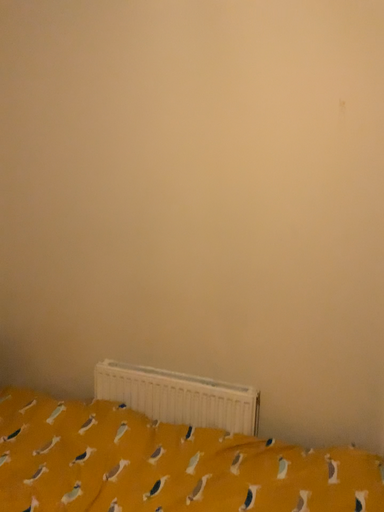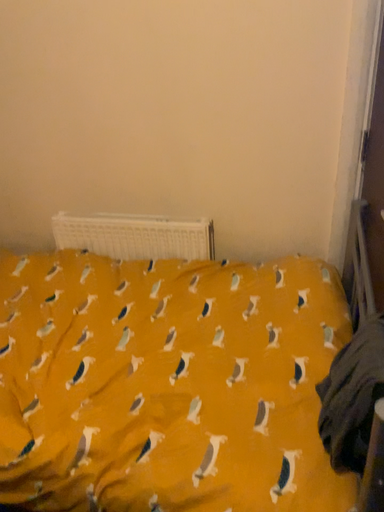
Question: Which way did the camera rotate in the video?

Choices:
 (A) rotated downward
 (B) rotated upward

Answer: (A)